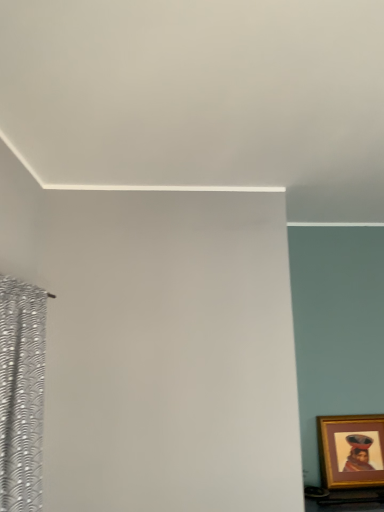
The height and width of the screenshot is (512, 384). What do you see at coordinates (351, 451) in the screenshot?
I see `gold-framed picture at lower right` at bounding box center [351, 451].

What is the approximate height of gold-framed picture at lower right?

gold-framed picture at lower right is 19.90 inches tall.

Identify the location of gold-framed picture at lower right. The width and height of the screenshot is (384, 512). (351, 451).

The image size is (384, 512). What are the coordinates of `gold-framed picture at lower right` in the screenshot? It's located at click(x=351, y=451).